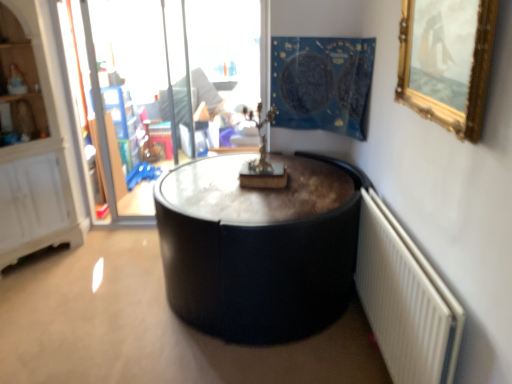
Question: Would you say blue fabric tapestry at upper center is outside gold-framed mirror at upper right?

Choices:
 (A) no
 (B) yes

Answer: (B)

Question: Can you confirm if blue fabric tapestry at upper center is positioned to the left of gold-framed mirror at upper right?

Choices:
 (A) no
 (B) yes

Answer: (B)

Question: Can you confirm if blue fabric tapestry at upper center is taller than gold-framed mirror at upper right?

Choices:
 (A) yes
 (B) no

Answer: (A)

Question: Would you say blue fabric tapestry at upper center is a long distance from gold-framed mirror at upper right?

Choices:
 (A) no
 (B) yes

Answer: (B)

Question: From a real-world perspective, does blue fabric tapestry at upper center sit lower than gold-framed mirror at upper right?

Choices:
 (A) yes
 (B) no

Answer: (A)

Question: Is blue fabric tapestry at upper center shorter than gold-framed mirror at upper right?

Choices:
 (A) no
 (B) yes

Answer: (A)

Question: Is white textured radiator at lower right completely or partially inside blue fabric tapestry at upper center?

Choices:
 (A) yes
 (B) no

Answer: (B)

Question: Does blue fabric tapestry at upper center have a greater height compared to white textured radiator at lower right?

Choices:
 (A) yes
 (B) no

Answer: (B)

Question: Does blue fabric tapestry at upper center have a smaller size compared to white textured radiator at lower right?

Choices:
 (A) no
 (B) yes

Answer: (A)

Question: Considering the relative positions of blue fabric tapestry at upper center and white textured radiator at lower right in the image provided, is blue fabric tapestry at upper center to the right of white textured radiator at lower right from the viewer's perspective?

Choices:
 (A) yes
 (B) no

Answer: (B)

Question: Is blue fabric tapestry at upper center positioned with its back to white textured radiator at lower right?

Choices:
 (A) yes
 (B) no

Answer: (B)

Question: From a real-world perspective, is blue fabric tapestry at upper center under white textured radiator at lower right?

Choices:
 (A) yes
 (B) no

Answer: (B)

Question: Is transparent glass door at upper left bigger than white textured radiator at lower right?

Choices:
 (A) no
 (B) yes

Answer: (B)